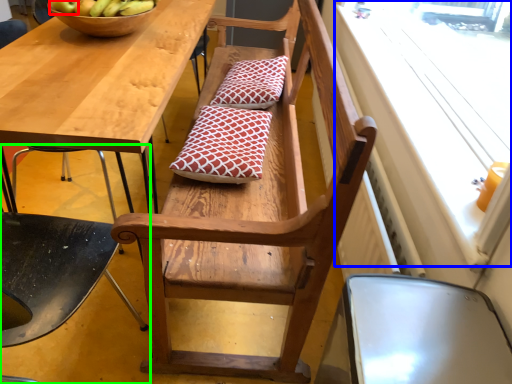
Question: Which object is the closest to the apple (highlighted by a red box)? Choose among these: window screen (highlighted by a blue box) or chair (highlighted by a green box).

Choices:
 (A) window screen
 (B) chair

Answer: (B)